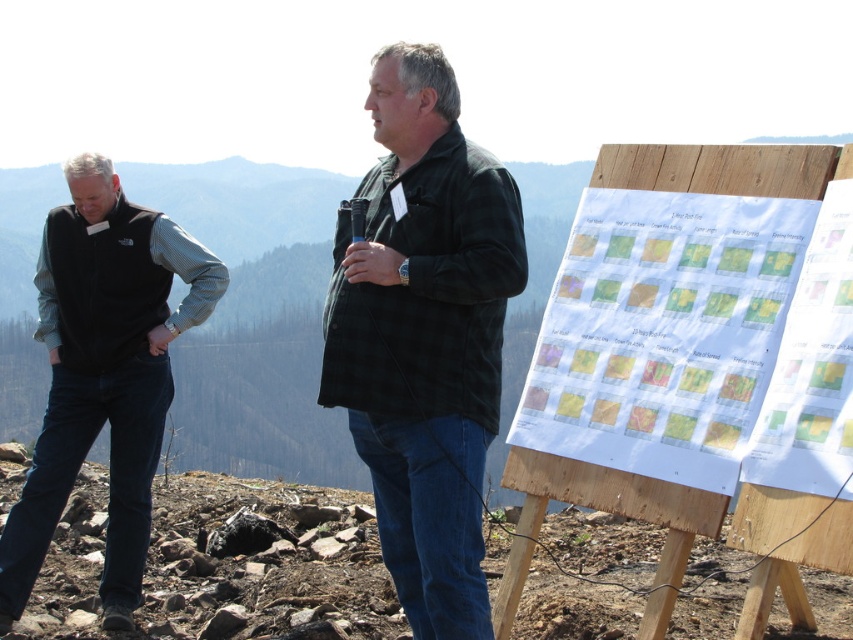
Question: Which point is farther to the camera?

Choices:
 (A) wooden at right
 (B) black corduroy jacket at center
 (C) black fleece vest at left

Answer: (C)

Question: Where is black corduroy jacket at center located in relation to wooden at right in the image?

Choices:
 (A) below
 (B) above

Answer: (B)

Question: Which object appears farthest from the camera in this image?

Choices:
 (A) black corduroy jacket at center
 (B) wooden at right

Answer: (A)

Question: Which of the following is the farthest from the observer?

Choices:
 (A) (750, 193)
 (B) (74, 387)

Answer: (B)

Question: Considering the relative positions of black corduroy jacket at center and black fleece vest at left in the image provided, where is black corduroy jacket at center located with respect to black fleece vest at left?

Choices:
 (A) below
 (B) above

Answer: (B)

Question: Does black fleece vest at left appear on the left side of wooden at right?

Choices:
 (A) no
 (B) yes

Answer: (B)